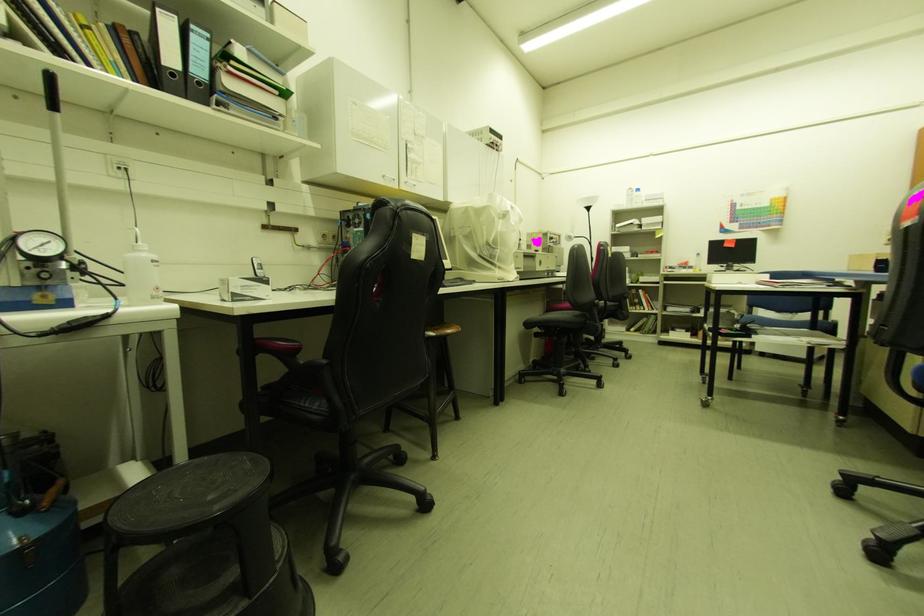
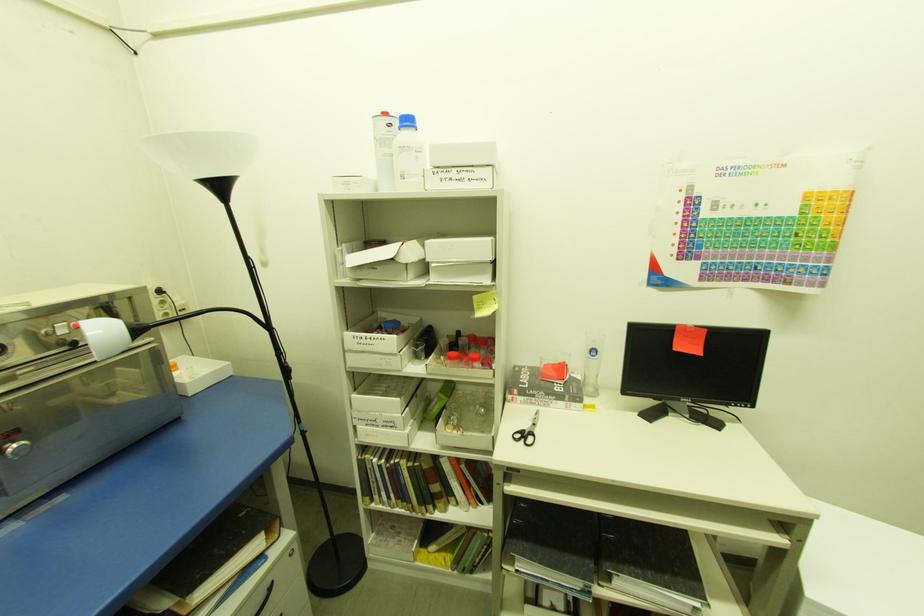
What movement of the cameraman would produce the second image?

The movement direction of the cameraman is right, forward.